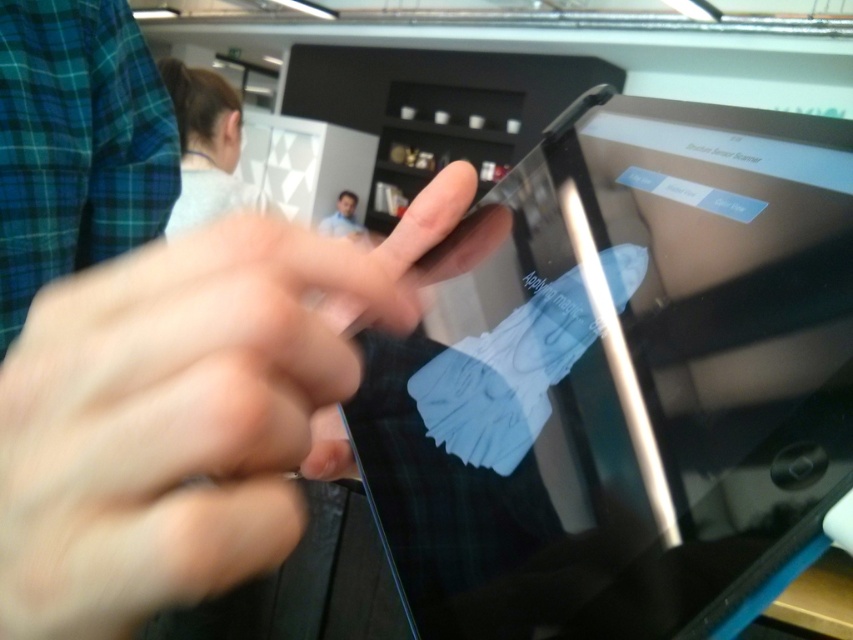
Question: Which point is closer to the camera?

Choices:
 (A) click(x=109, y=364)
 (B) click(x=636, y=205)
 (C) click(x=347, y=198)

Answer: (A)

Question: Considering the real-world distances, which object is farthest from the black glossy tablet at center?

Choices:
 (A) blue matte face at upper center
 (B) matte black finger at center

Answer: (A)

Question: Does black glossy tablet at center appear on the left side of matte black finger at center?

Choices:
 (A) no
 (B) yes

Answer: (A)

Question: Which object is the closest to the blue matte face at upper center?

Choices:
 (A) black glossy tablet at center
 (B) matte black finger at center

Answer: (A)

Question: Does black glossy tablet at center appear under matte black finger at center?

Choices:
 (A) yes
 (B) no

Answer: (B)

Question: Does black glossy tablet at center appear on the right side of blue matte face at upper center?

Choices:
 (A) no
 (B) yes

Answer: (B)